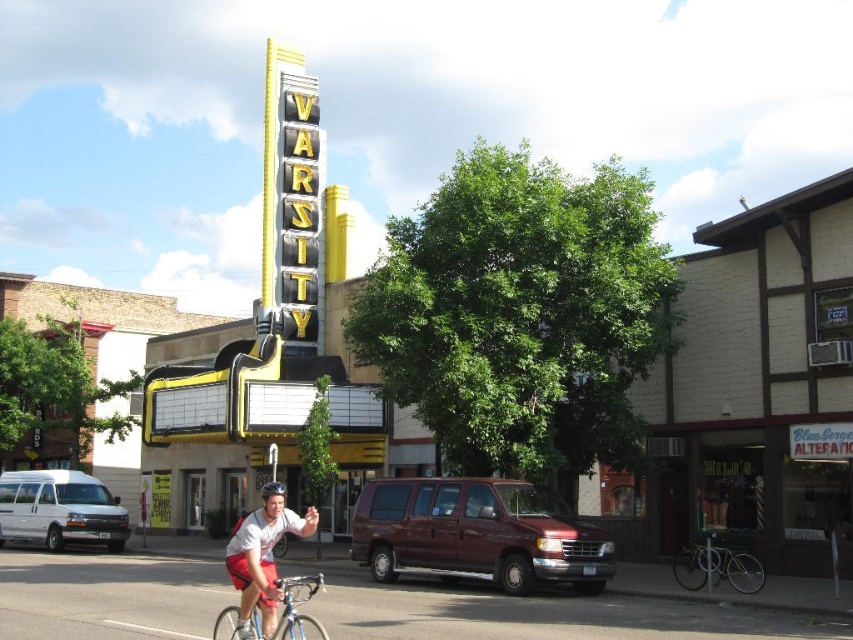
Question: Which of the following is the farthest from the observer?

Choices:
 (A) white van at left
 (B) shiny silver bicycle at lower right
 (C) silver metallic bicycle at lower left

Answer: (A)

Question: Is shiny silver bicycle at lower right positioned behind silver metallic bicycle at lower left?

Choices:
 (A) yes
 (B) no

Answer: (A)

Question: Can you confirm if white van at left is smaller than matte white helmet at center?

Choices:
 (A) no
 (B) yes

Answer: (B)

Question: Which of these objects is positioned farthest from the white van at left?

Choices:
 (A) silver metallic bicycle at lower left
 (B) shiny silver bicycle at lower right
 (C) maroon matte van at center
 (D) matte white helmet at center

Answer: (B)

Question: Does matte white helmet at center appear on the right side of silver metallic bicycle at lower left?

Choices:
 (A) yes
 (B) no

Answer: (B)

Question: Which is farther from the matte white helmet at center?

Choices:
 (A) silver metallic bicycle at lower left
 (B) maroon matte van at center

Answer: (B)